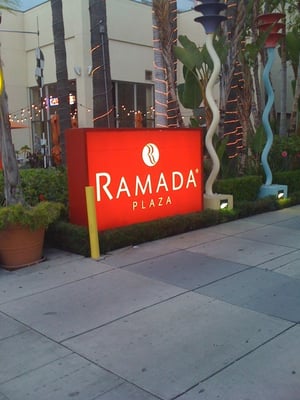
Find the location of a particular element. The image size is (300, 400). rope lights is located at coordinates (231, 120), (161, 114), (98, 66).